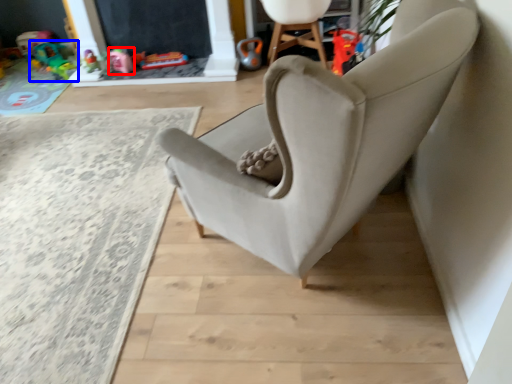
Question: Which object appears closest to the camera in this image, toy (highlighted by a red box) or toy (highlighted by a blue box)?

Choices:
 (A) toy
 (B) toy

Answer: (A)